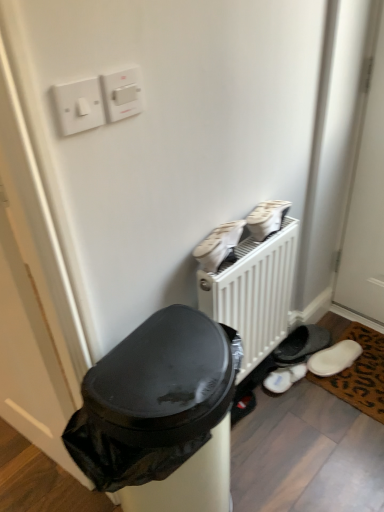
Question: Is white fluffy slippers at lower right, which is the third footwear from front to back, closer to camera compared to brown leopard print mat at lower right?

Choices:
 (A) no
 (B) yes

Answer: (A)

Question: Considering the relative positions of white fluffy slippers at lower right, which is the third footwear in top-to-bottom order, and brown leopard print mat at lower right in the image provided, is white fluffy slippers at lower right, which is the third footwear in top-to-bottom order, to the left of brown leopard print mat at lower right from the viewer's perspective?

Choices:
 (A) yes
 (B) no

Answer: (A)

Question: Is white fluffy slippers at lower right, which is the third footwear in top-to-bottom order, wider than brown leopard print mat at lower right?

Choices:
 (A) yes
 (B) no

Answer: (B)

Question: From the image's perspective, is white fluffy slippers at lower right, which is the third footwear from front to back, located beneath brown leopard print mat at lower right?

Choices:
 (A) yes
 (B) no

Answer: (A)

Question: Does white fluffy slippers at lower right, which is the third footwear in top-to-bottom order, touch brown leopard print mat at lower right?

Choices:
 (A) yes
 (B) no

Answer: (B)

Question: Is point (271, 334) closer or farther from the camera than point (268, 230)?

Choices:
 (A) farther
 (B) closer

Answer: (A)

Question: Considering the positions of white matte radiator at center and white fabric shoes at upper right, acting as the third footwear starting from the bottom, in the image, is white matte radiator at center bigger or smaller than white fabric shoes at upper right, acting as the third footwear starting from the bottom,?

Choices:
 (A) small
 (B) big

Answer: (B)

Question: From a real-world perspective, is white matte radiator at center positioned above or below white fabric shoes at upper right, placed as the 2th footwear when sorted from back to front?

Choices:
 (A) above
 (B) below

Answer: (B)

Question: Looking at their shapes, would you say white matte radiator at center is wider or thinner than white fabric shoes at upper right, acting as the third footwear starting from the bottom?

Choices:
 (A) wide
 (B) thin

Answer: (A)

Question: Choose the correct answer: Is brown leopard print mat at lower right inside white fabric shoes at upper right, arranged as the 1th footwear when viewed from the top, or outside it?

Choices:
 (A) inside
 (B) outside

Answer: (B)

Question: Is brown leopard print mat at lower right taller or shorter than white fabric shoes at upper right, arranged as the 1th footwear when viewed from the top?

Choices:
 (A) tall
 (B) short

Answer: (B)

Question: From a real-world perspective, is brown leopard print mat at lower right physically located above or below white fabric shoes at upper right, positioned as the 2th footwear in front-to-back order?

Choices:
 (A) above
 (B) below

Answer: (B)

Question: Relative to white fabric shoes at upper right, arranged as the 1th footwear when viewed from the top, is brown leopard print mat at lower right in front or behind?

Choices:
 (A) front
 (B) behind

Answer: (B)

Question: Considering the positions of brown leopard print mat at lower right and white fluffy slippers at lower right, placed as the first footwear when sorted from bottom to top, in the image, is brown leopard print mat at lower right bigger or smaller than white fluffy slippers at lower right, placed as the first footwear when sorted from bottom to top,?

Choices:
 (A) small
 (B) big

Answer: (B)

Question: Which is correct: brown leopard print mat at lower right is inside white fluffy slippers at lower right, which is the third footwear from front to back, or outside of it?

Choices:
 (A) outside
 (B) inside

Answer: (A)